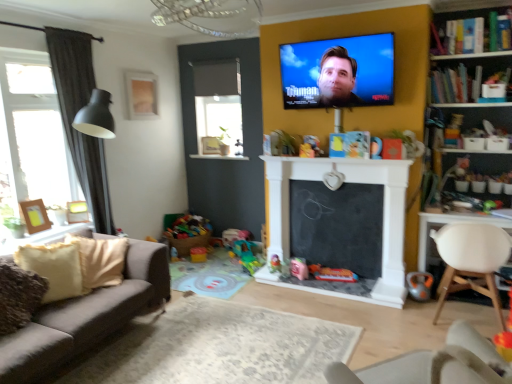
This screenshot has width=512, height=384. I want to click on free point above metallic orange toy at lower right, which ranks as the 7th toy in top-to-bottom order (from a real-world perspective), so click(x=424, y=267).